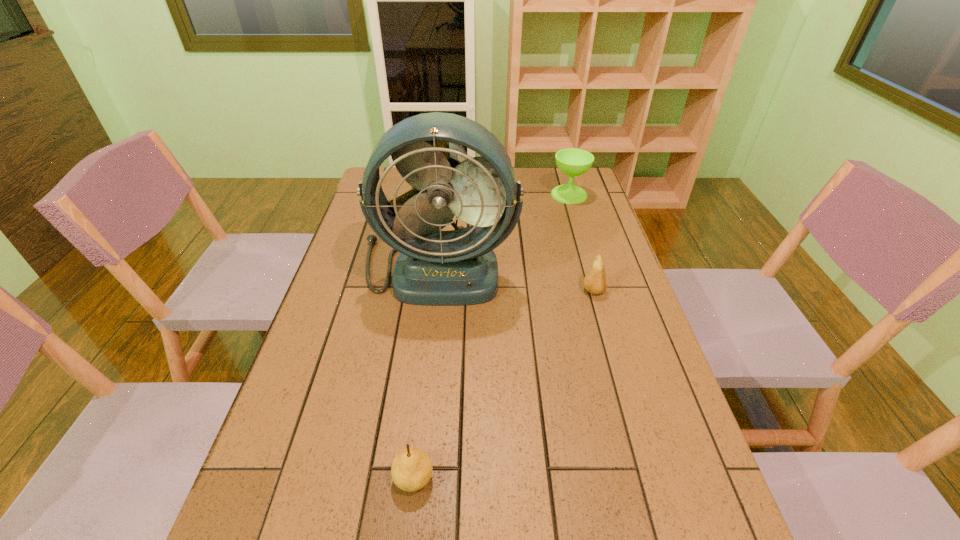
Where is `the tallest object`? The height and width of the screenshot is (540, 960). the tallest object is located at coordinates (458, 267).

Locate an element on the screen. Image resolution: width=960 pixels, height=540 pixels. wineglass is located at coordinates (573, 162).

This screenshot has height=540, width=960. Identify the location of the farthest object. (573, 162).

At what (x,y) coordinates should I click in order to perform the action: click on the farther pear. Please return your answer as a coordinate pair (x, y). Looking at the image, I should click on (595, 281).

The image size is (960, 540). I want to click on the left pear, so click(x=412, y=468).

At what (x,y) coordinates should I click in order to perform the action: click on the nearer pear. Please return your answer as a coordinate pair (x, y). The width and height of the screenshot is (960, 540). Looking at the image, I should click on (412, 468).

Find the location of a particular element. The width and height of the screenshot is (960, 540). free space located in front of the fan to blow air is located at coordinates (419, 447).

Find the location of a particular element. This screenshot has width=960, height=540. free region located 0.270m on the left of the second tallest object is located at coordinates (477, 194).

This screenshot has height=540, width=960. I want to click on free region located 0.200m on the left of the right pear, so click(510, 291).

The image size is (960, 540). I want to click on vacant space positioned on the right of the nearest object, so click(x=513, y=478).